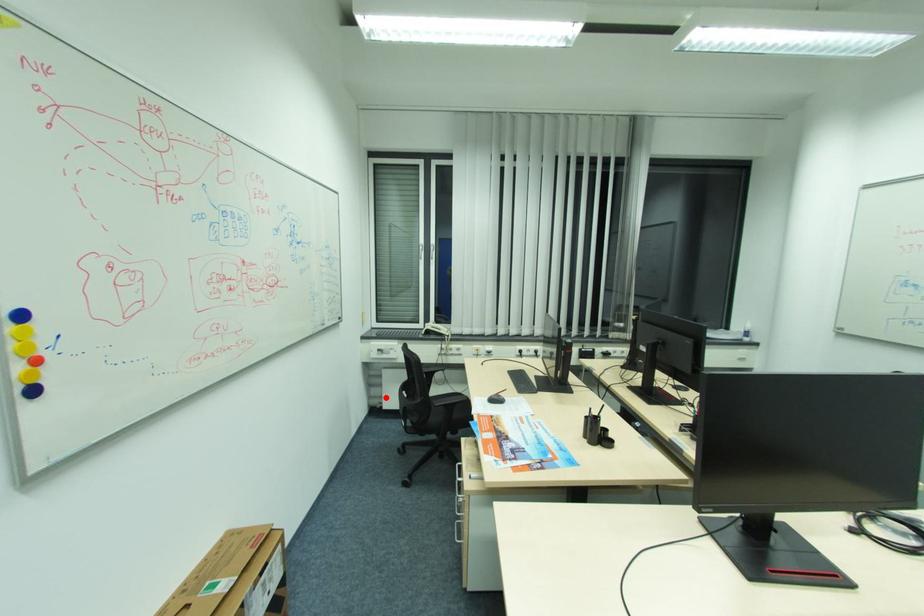
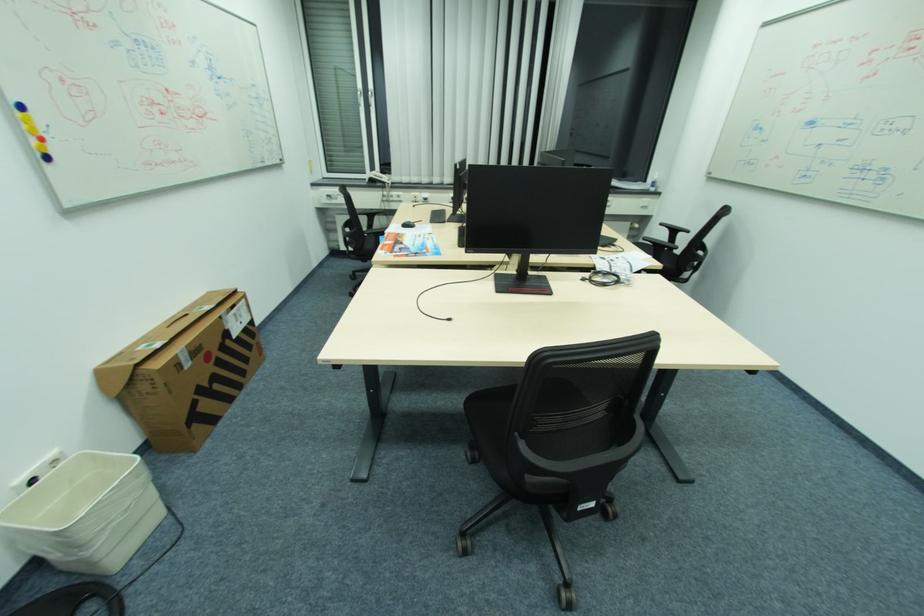
Find the pixel in the second image that matches the highlighted location in the first image.

(343, 241)